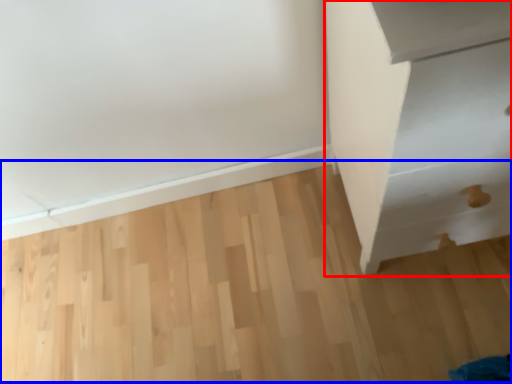
Question: Which object is closer to the camera taking this photo, furniture (highlighted by a red box) or plywood (highlighted by a blue box)?

Choices:
 (A) furniture
 (B) plywood

Answer: (A)